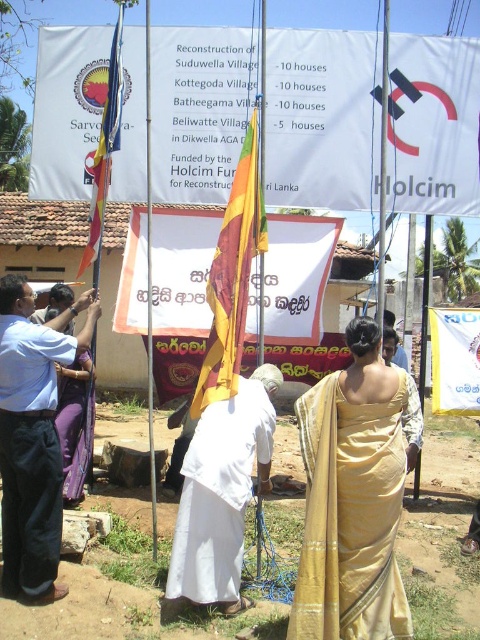
Consider the image. Between gold silk saree at center and light blue shirt at center, which one appears on the left side from the viewer's perspective?

From the viewer's perspective, light blue shirt at center appears more on the left side.

Who is more distant from viewer, (325, 573) or (62, 337)?

The point (62, 337) is more distant.

Locate an element on the screen. The height and width of the screenshot is (640, 480). gold silk saree at center is located at coordinates (352, 497).

Which is below, light blue shirt at center or matte fabric flag at left?

light blue shirt at center is below.

Who is shorter, light blue shirt at center or matte fabric flag at left?

Standing shorter between the two is light blue shirt at center.

Is point (26, 592) farther from camera compared to point (108, 118)?

No, it is in front of (108, 118).

Where is `light blue shirt at center`? The width and height of the screenshot is (480, 640). light blue shirt at center is located at coordinates (33, 436).

Does light blue shirt at center appear on the left side of white cloth at center?

Correct, you'll find light blue shirt at center to the left of white cloth at center.

Can you confirm if light blue shirt at center is bigger than white cloth at center?

No.

The width and height of the screenshot is (480, 640). Describe the element at coordinates (33, 436) in the screenshot. I see `light blue shirt at center` at that location.

Find the location of a particular element. light blue shirt at center is located at coordinates (33, 436).